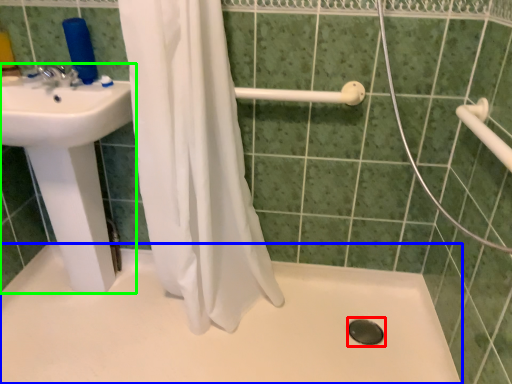
Question: Which object is positioned farthest from drain (highlighted by a red box)? Select from bath (highlighted by a blue box) and sink (highlighted by a green box).

Choices:
 (A) bath
 (B) sink

Answer: (B)